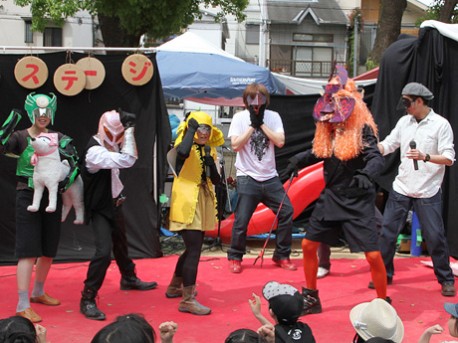
This screenshot has width=458, height=343. What are the coordinates of `black curtain` in the screenshot? It's located at (438, 63), (83, 114), (297, 114).